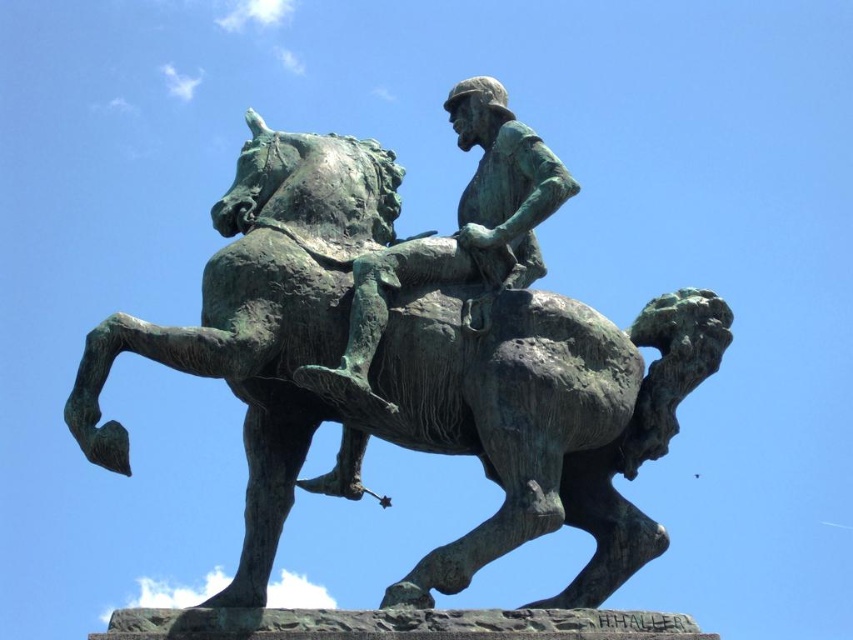
Which is behind, point (347, 420) or point (486, 195)?

The point (486, 195) is more distant.

Can you confirm if green patina horse and rider at center is positioned to the left of green patina figure at center?

Yes, green patina horse and rider at center is to the left of green patina figure at center.

Is point (393, 422) farther from viewer compared to point (485, 252)?

No.

Identify the location of green patina horse and rider at center. Image resolution: width=853 pixels, height=640 pixels. [421, 352].